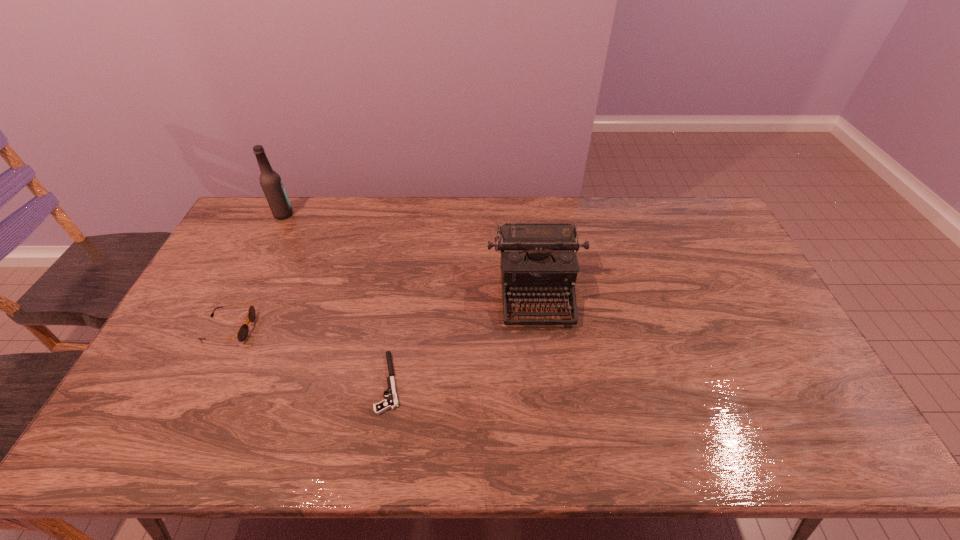
The image size is (960, 540). Identify the location of vacant region at the right edge. (730, 254).

You are a GUI agent. You are given a task and a screenshot of the screen. Output one action in this format:
    pyautogui.click(x=<x>, y=<y>)
    Task: Click on the blank space at the far right corner
    The height and width of the screenshot is (540, 960).
    Given the screenshot: What is the action you would take?
    pyautogui.click(x=717, y=221)

At what (x,y) coordinates should I click in order to perform the action: click on vacant space in between the third tallest object and the farthest object. Please return your answer as a coordinate pair (x, y). Looking at the image, I should click on (256, 272).

Find the location of a particular element. This screenshot has width=960, height=540. free space between the farthest object and the pistol is located at coordinates (337, 299).

Locate an element on the screen. vacant space that is in between the rightmost object and the second object from right to left is located at coordinates (463, 337).

Identify the location of free space between the sunglasses and the typewriter. The width and height of the screenshot is (960, 540). pos(382,310).

Locate an element on the screen. free space between the tallest object and the sunglasses is located at coordinates (256, 272).

Find the location of a particular element. This screenshot has width=960, height=540. free space that is in between the pistol and the sunglasses is located at coordinates (309, 355).

Identify the location of unoccupied area between the third tallest object and the beer bottle. (256, 272).

You are a GUI agent. You are given a task and a screenshot of the screen. Output one action in this format:
    pyautogui.click(x=<x>, y=<y>)
    Task: Click on the empty space that is in between the tallest object and the typewriter
    
    Given the screenshot: What is the action you would take?
    pyautogui.click(x=410, y=253)